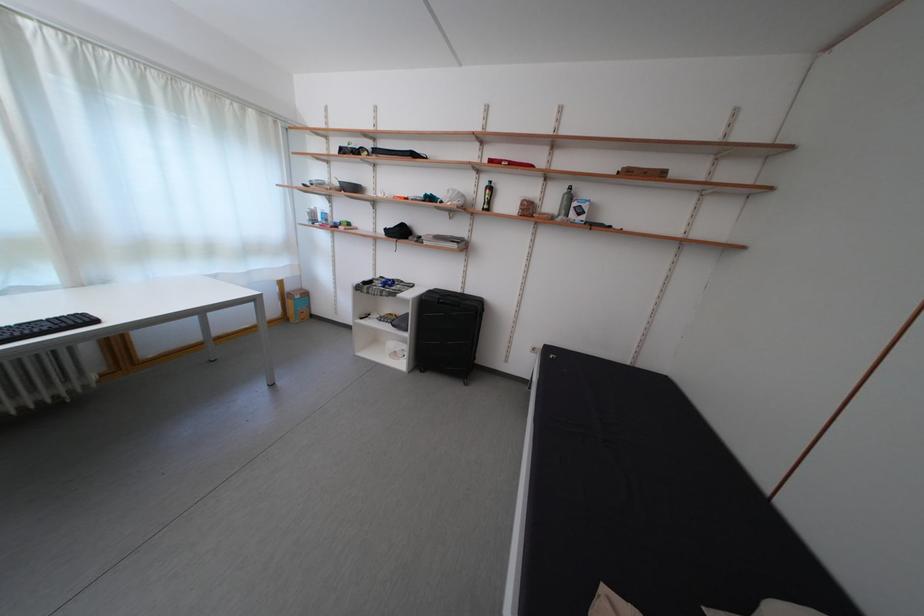
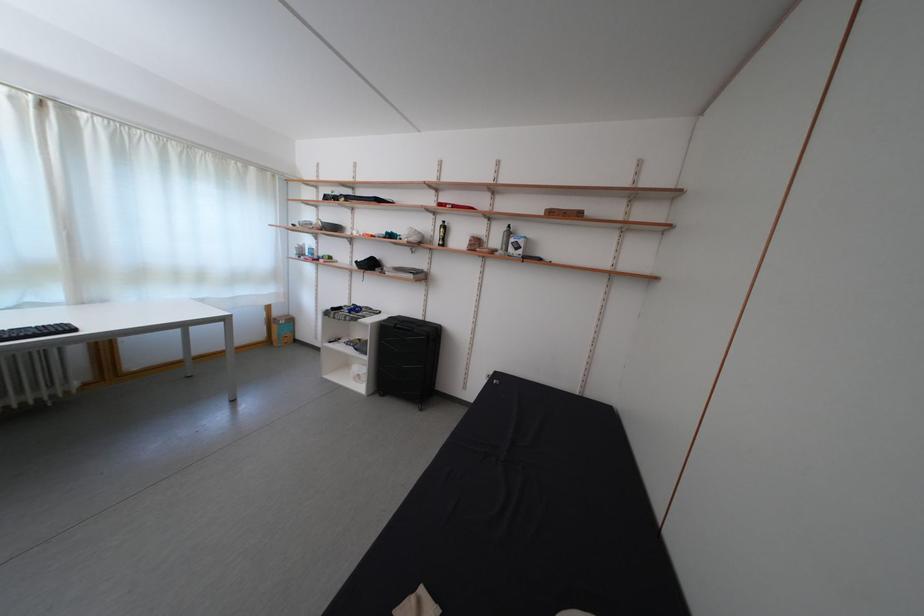
The point at (298,294) is marked in the first image. Where is the corresponding point in the second image?

(285, 320)